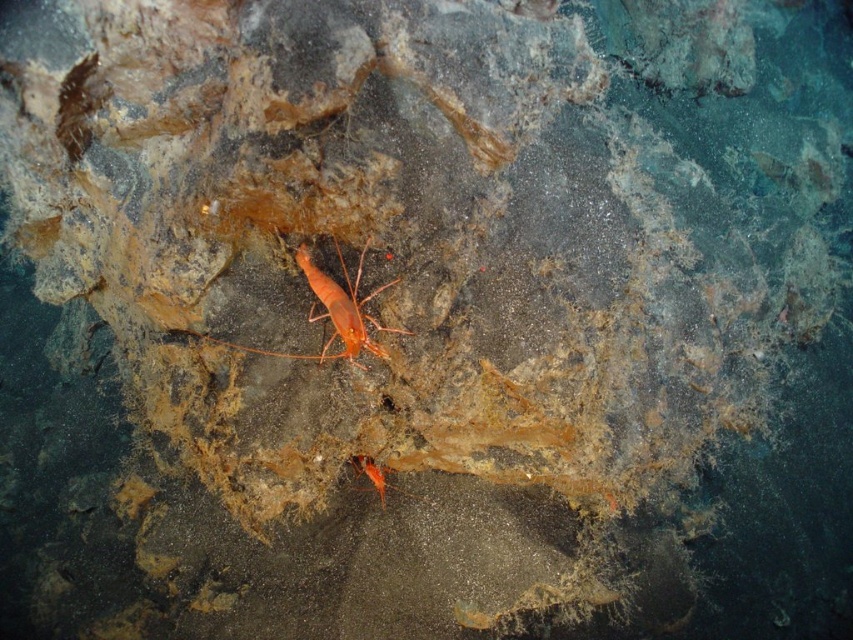
Question: Can you confirm if orange matte shrimp at center is positioned below orange matte shrimp at lower center?

Choices:
 (A) no
 (B) yes

Answer: (A)

Question: Where is orange matte shrimp at center located in relation to orange matte shrimp at lower center in the image?

Choices:
 (A) left
 (B) right

Answer: (A)

Question: Which point appears closest to the camera in this image?

Choices:
 (A) (383, 467)
 (B) (334, 312)

Answer: (B)

Question: Which point is farther to the camera?

Choices:
 (A) orange matte shrimp at lower center
 (B) orange matte shrimp at center

Answer: (A)

Question: Is orange matte shrimp at center thinner than orange matte shrimp at lower center?

Choices:
 (A) no
 (B) yes

Answer: (A)